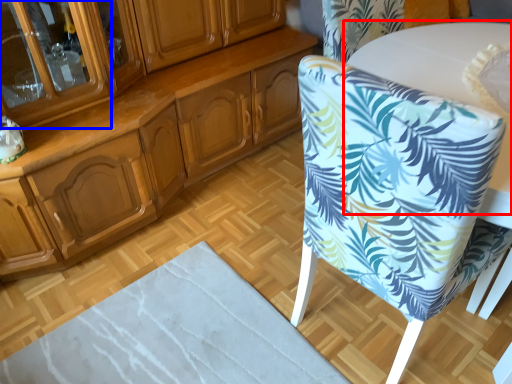
Question: Which point is further to the camera, round table (highlighted by a red box) or glass door (highlighted by a blue box)?

Choices:
 (A) round table
 (B) glass door

Answer: (A)